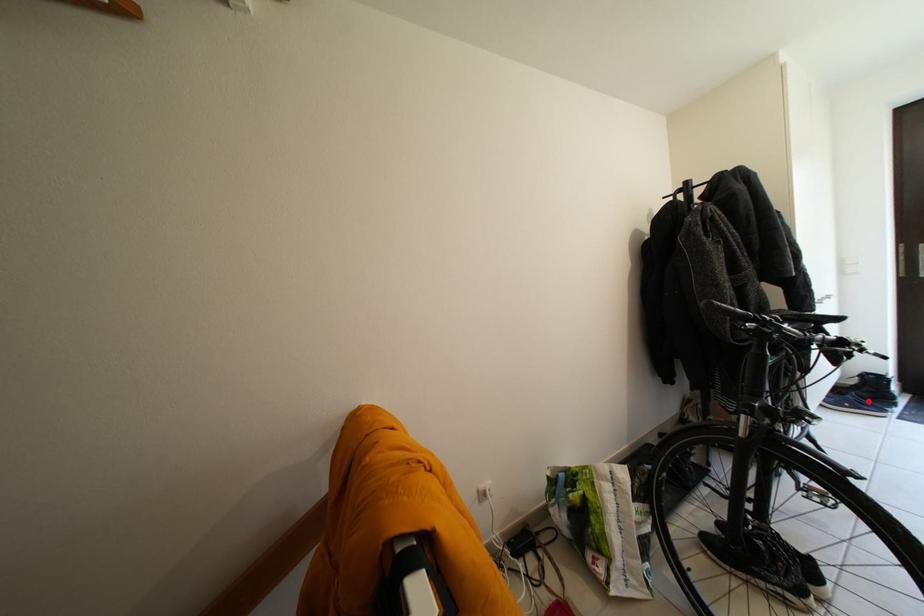
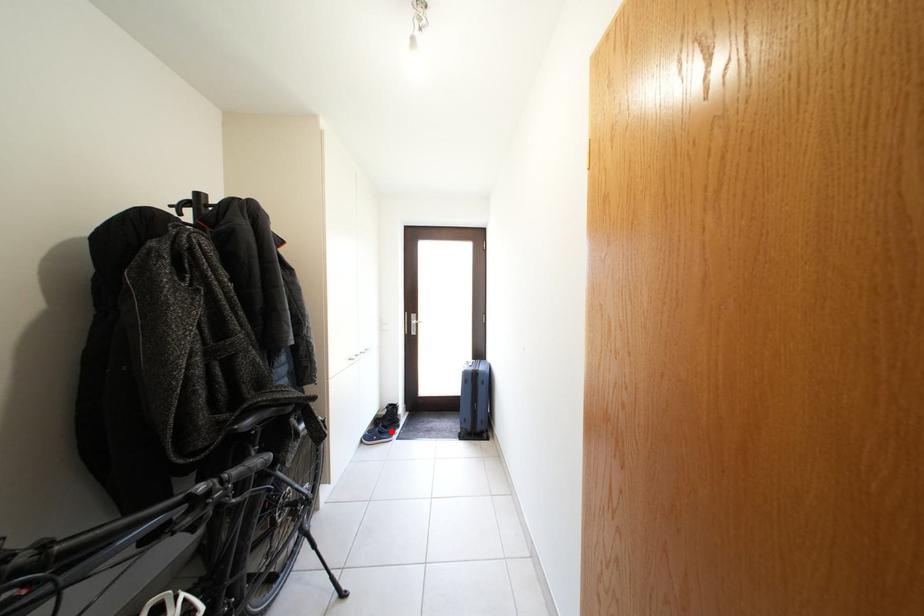
I am providing you with two images of the same scene from different viewpoints. A red point is marked on the first image and another point is marked on the second image. Does the point marked in image1 correspond to the same location as the one in image2?

Yes